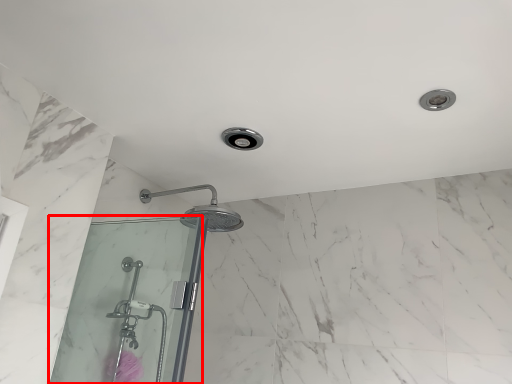
Question: From the image's perspective, considering the relative positions of screen door (annotated by the red box) and flower in the image provided, where is screen door (annotated by the red box) located with respect to the staircase?

Choices:
 (A) below
 (B) above

Answer: (B)